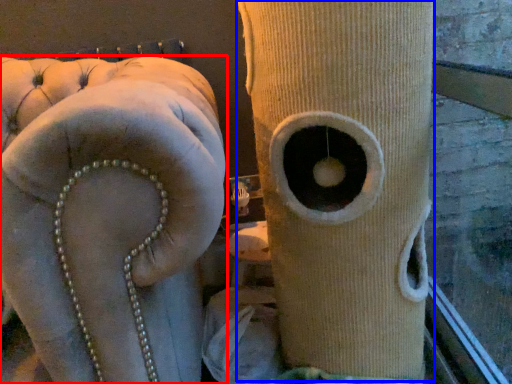
Question: Which object appears farthest to the camera in this image, furniture (highlighted by a red box) or tree trunk (highlighted by a blue box)?

Choices:
 (A) furniture
 (B) tree trunk

Answer: (B)